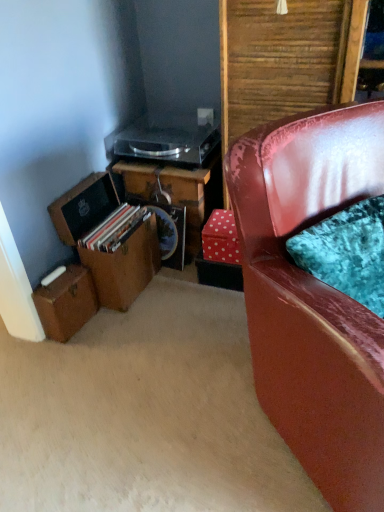
Question: From the image's perspective, does shiny red leather chair at right appear lower than red polka dot cardboard box at lower right?

Choices:
 (A) no
 (B) yes

Answer: (B)

Question: Is shiny red leather chair at right oriented away from red polka dot cardboard box at lower right?

Choices:
 (A) yes
 (B) no

Answer: (A)

Question: Is shiny red leather chair at right at the right side of red polka dot cardboard box at lower right?

Choices:
 (A) yes
 (B) no

Answer: (A)

Question: From a real-world perspective, is shiny red leather chair at right on top of red polka dot cardboard box at lower right?

Choices:
 (A) yes
 (B) no

Answer: (A)

Question: Can you confirm if shiny red leather chair at right is bigger than red polka dot cardboard box at lower right?

Choices:
 (A) no
 (B) yes

Answer: (B)

Question: Considering the positions of brown leather suitcase at lower left, the first box viewed from the top, and brown leather suitcase at lower left, which ranks as the 1th box in bottom-to-top order, in the image, is brown leather suitcase at lower left, the first box viewed from the top, wider or thinner than brown leather suitcase at lower left, which ranks as the 1th box in bottom-to-top order,?

Choices:
 (A) thin
 (B) wide

Answer: (B)

Question: Does point (72, 190) appear closer or farther from the camera than point (74, 311)?

Choices:
 (A) closer
 (B) farther

Answer: (B)

Question: Looking at the image, does brown leather suitcase at lower left, the second box from the bottom, seem bigger or smaller compared to brown leather suitcase at lower left, which appears as the 2th box when viewed from the top?

Choices:
 (A) small
 (B) big

Answer: (B)

Question: Based on their positions, is brown leather suitcase at lower left, the second box from the bottom, located to the left or right of brown leather suitcase at lower left, which ranks as the 1th box in bottom-to-top order?

Choices:
 (A) right
 (B) left

Answer: (A)

Question: Is point (142, 190) closer or farther from the camera than point (203, 161)?

Choices:
 (A) closer
 (B) farther

Answer: (B)

Question: Would you say wooden desk at center is to the left or to the right of transparent plastic record player at upper center in the picture?

Choices:
 (A) right
 (B) left

Answer: (A)

Question: Based on their sizes in the image, would you say wooden desk at center is bigger or smaller than transparent plastic record player at upper center?

Choices:
 (A) big
 (B) small

Answer: (A)

Question: In terms of width, does wooden desk at center look wider or thinner when compared to transparent plastic record player at upper center?

Choices:
 (A) thin
 (B) wide

Answer: (A)

Question: Looking at their shapes, would you say transparent plastic record player at upper center is wider or thinner than brown leather suitcase at lower left, which ranks as the 1th box in bottom-to-top order?

Choices:
 (A) wide
 (B) thin

Answer: (A)

Question: From the image's perspective, is transparent plastic record player at upper center positioned above or below brown leather suitcase at lower left, which appears as the 2th box when viewed from the top?

Choices:
 (A) above
 (B) below

Answer: (A)